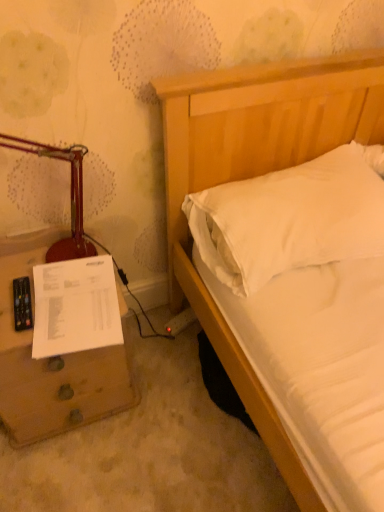
Question: Is white soft pillow at upper right bigger or smaller than brown wooden nightstand at lower left?

Choices:
 (A) small
 (B) big

Answer: (A)

Question: In the image, is white soft pillow at upper right positioned in front of or behind brown wooden nightstand at lower left?

Choices:
 (A) front
 (B) behind

Answer: (B)

Question: Considering the real-world distances, which object is closest to the white paper at lower left?

Choices:
 (A) brown wooden nightstand at lower left
 (B) white soft pillow at upper right
 (C) matte red table lamp at left

Answer: (A)

Question: Which object is positioned farthest from the brown wooden nightstand at lower left?

Choices:
 (A) white paper at lower left
 (B) matte red table lamp at left
 (C) white soft pillow at upper right

Answer: (C)